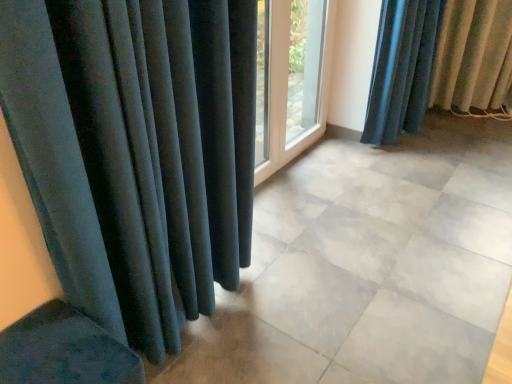
Question: From a real-world perspective, is white glass door at center physically located above or below velvet dark blue curtain at right?

Choices:
 (A) above
 (B) below

Answer: (A)

Question: Is white glass door at center inside or outside of velvet dark blue curtain at right?

Choices:
 (A) inside
 (B) outside

Answer: (B)

Question: Does point (314, 39) appear closer or farther from the camera than point (493, 107)?

Choices:
 (A) farther
 (B) closer

Answer: (B)

Question: Looking at the image, does velvet dark blue curtain at right seem bigger or smaller compared to white glass door at center?

Choices:
 (A) big
 (B) small

Answer: (A)

Question: Is velvet dark blue curtain at right in front of or behind white glass door at center in the image?

Choices:
 (A) behind
 (B) front

Answer: (A)

Question: From the image's perspective, is velvet dark blue curtain at right positioned above or below white glass door at center?

Choices:
 (A) above
 (B) below

Answer: (A)

Question: Is point (477, 102) positioned closer to the camera than point (291, 94)?

Choices:
 (A) farther
 (B) closer

Answer: (A)